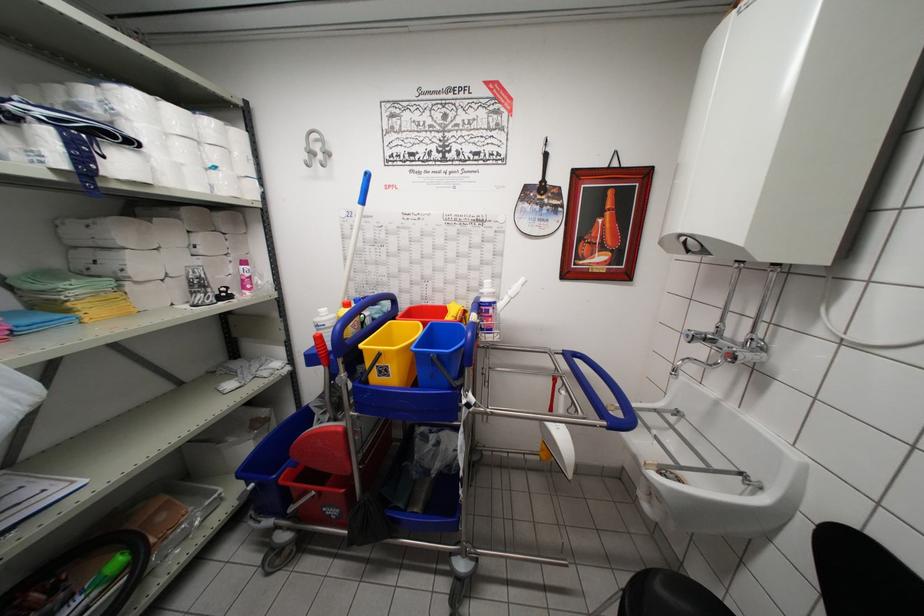
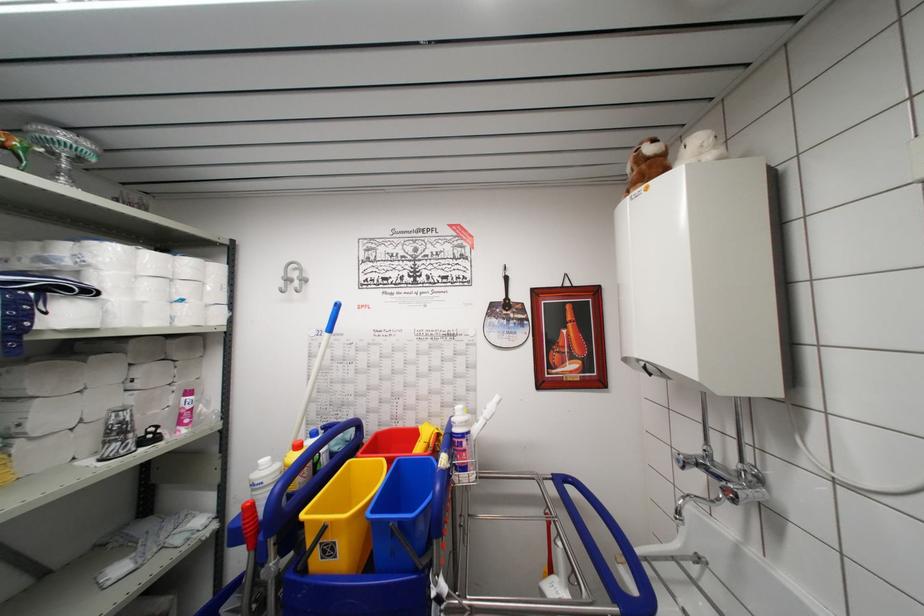
The point at (216, 161) is marked in the first image. Where is the corresponding point in the second image?

(188, 294)